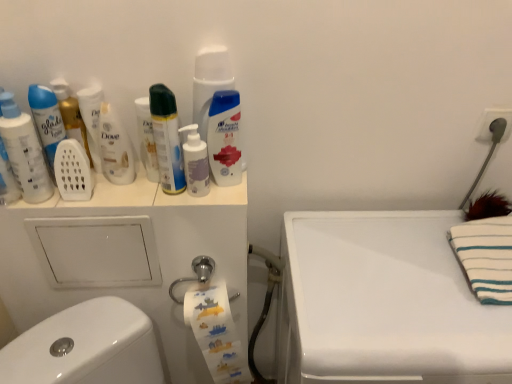
The width and height of the screenshot is (512, 384). What are the coordinates of `vacant area to the left of white striped towel at upper right` in the screenshot? It's located at (410, 273).